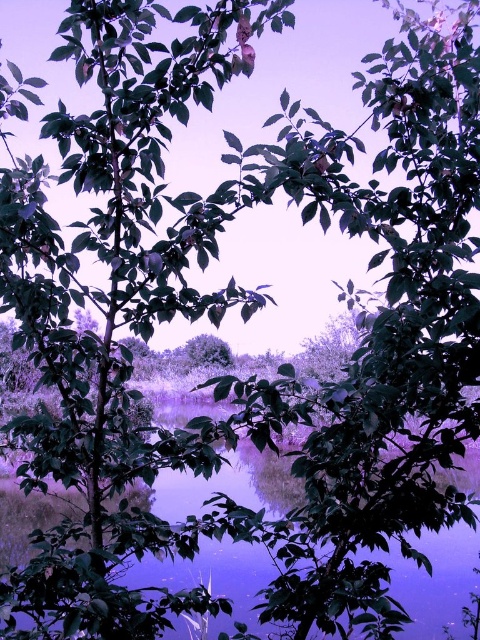
You are standing in the serene natural scene and want to take a photo of both the purple reflective water at center and the green matte tree at center. Which object should you position to your left side in the camera frame?

The green matte tree at center should be positioned to your left side in the camera frame because the purple reflective water at center is to the right of it.

You are standing in the serene natural scene and want to take a photo of the purple reflective water at center and the green matte tree at center. Which object will appear larger in your photo?

The purple reflective water at center will appear larger in the photo because it is closer to the viewer than the green matte tree at center.